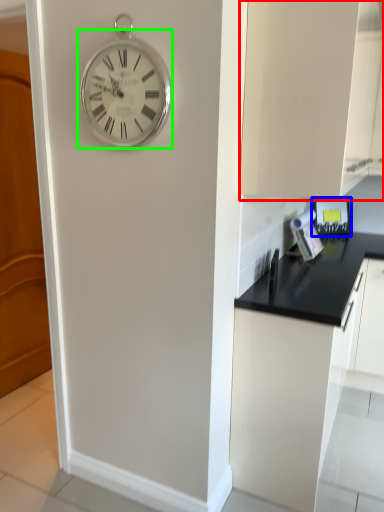
Question: Which object is positioned farthest from cabinetry (highlighted by a red box)? Select from appliance (highlighted by a blue box) and wall clock (highlighted by a green box).

Choices:
 (A) appliance
 (B) wall clock

Answer: (A)